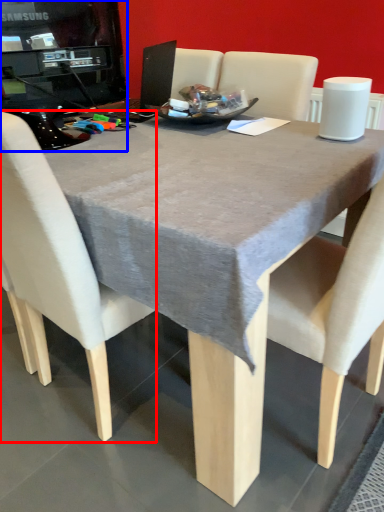
Question: Among these objects, which one is farthest to the camera, chair (highlighted by a red box) or desktop computer (highlighted by a blue box)?

Choices:
 (A) chair
 (B) desktop computer

Answer: (B)